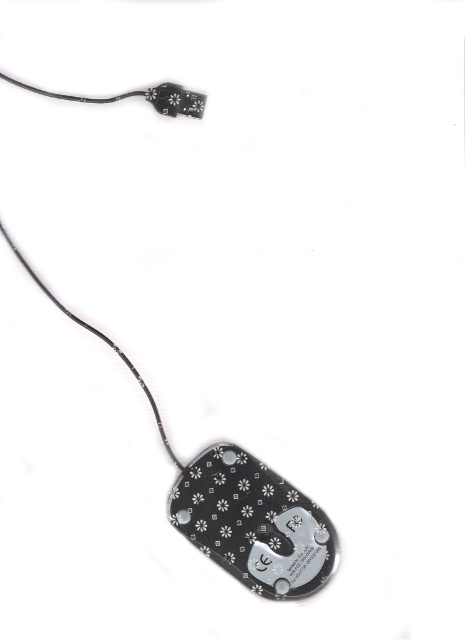
Question: Is black glossy mouse at bottom bigger than black glossy plug at upper center?

Choices:
 (A) yes
 (B) no

Answer: (A)

Question: Does black glossy mouse at bottom appear on the left side of black glossy plug at upper center?

Choices:
 (A) yes
 (B) no

Answer: (A)

Question: Which object appears closest to the camera in this image?

Choices:
 (A) black glossy mouse at bottom
 (B) black glossy plug at upper center

Answer: (A)

Question: Is black glossy mouse at bottom positioned behind black glossy plug at upper center?

Choices:
 (A) no
 (B) yes

Answer: (A)